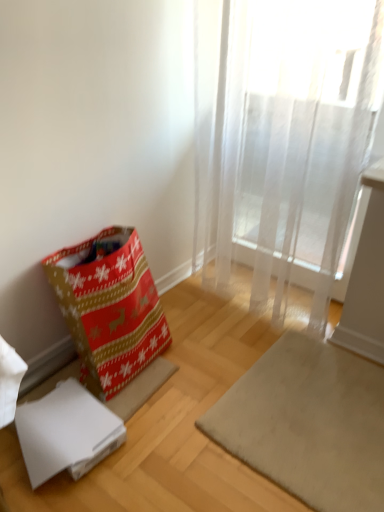
What do you see at coordinates (308, 423) in the screenshot? This screenshot has width=384, height=512. I see `beige carpet at lower center` at bounding box center [308, 423].

What do you see at coordinates (66, 432) in the screenshot? I see `white cardboard box at lower left` at bounding box center [66, 432].

What do you see at coordinates (290, 142) in the screenshot? I see `translucent white curtain at upper right` at bounding box center [290, 142].

Image resolution: width=384 pixels, height=512 pixels. What do you see at coordinates (109, 307) in the screenshot? I see `christmas-patterned fabric gift bag at lower left` at bounding box center [109, 307].

At what (x,y) coordinates should I click in order to perform the action: click on beige carpet at lower center. Please return your answer as a coordinate pair (x, y). Looking at the image, I should click on (308, 423).

From a real-world perspective, is translucent white curtain at upper right above or below christmas-patterned fabric gift bag at lower left?

In terms of real-world spatial position, translucent white curtain at upper right is above christmas-patterned fabric gift bag at lower left.

Is translucent white curtain at upper right further to the viewer compared to christmas-patterned fabric gift bag at lower left?

No, it is not.

Can you confirm if translucent white curtain at upper right is positioned to the right of christmas-patterned fabric gift bag at lower left?

Correct, you'll find translucent white curtain at upper right to the right of christmas-patterned fabric gift bag at lower left.

Could you tell me if translucent white curtain at upper right is facing christmas-patterned fabric gift bag at lower left?

Yes, translucent white curtain at upper right is oriented towards christmas-patterned fabric gift bag at lower left.

Is white cardboard box at lower left positioned with its back to beige carpet at lower center?

No, white cardboard box at lower left is not facing the opposite direction of beige carpet at lower center.

Looking at this image, would you say white cardboard box at lower left is inside or outside beige carpet at lower center?

white cardboard box at lower left is outside beige carpet at lower center.

Who is more distant, white cardboard box at lower left or beige carpet at lower center?

white cardboard box at lower left is more distant.

From a real-world perspective, between white cardboard box at lower left and beige carpet at lower center, who is vertically higher?

In real-world perspective, white cardboard box at lower left is above.

Which is more to the right, translucent white curtain at upper right or white cardboard box at lower left?

From the viewer's perspective, translucent white curtain at upper right appears more on the right side.

Considering the sizes of translucent white curtain at upper right and white cardboard box at lower left in the image, is translucent white curtain at upper right wider or thinner than white cardboard box at lower left?

In the image, translucent white curtain at upper right appears to be more narrow than white cardboard box at lower left.

From the image's perspective, which is above, translucent white curtain at upper right or white cardboard box at lower left?

translucent white curtain at upper right appears higher in the image.

Which object is closer to the camera taking this photo, translucent white curtain at upper right or white cardboard box at lower left?

translucent white curtain at upper right is in front.

Would you say white cardboard box at lower left contains christmas-patterned fabric gift bag at lower left?

No, christmas-patterned fabric gift bag at lower left is located outside of white cardboard box at lower left.

Is white cardboard box at lower left not near christmas-patterned fabric gift bag at lower left?

white cardboard box at lower left is near christmas-patterned fabric gift bag at lower left, not far away.

How different are the orientations of white cardboard box at lower left and christmas-patterned fabric gift bag at lower left in degrees?

The angular difference between white cardboard box at lower left and christmas-patterned fabric gift bag at lower left is 2.31 degrees.

Is white cardboard box at lower left taller than christmas-patterned fabric gift bag at lower left?

No, white cardboard box at lower left is not taller than christmas-patterned fabric gift bag at lower left.

Where is `mat in front of the translucent white curtain at upper right`? The width and height of the screenshot is (384, 512). mat in front of the translucent white curtain at upper right is located at coordinates (308, 423).

Is beige carpet at lower center in contact with translucent white curtain at upper right?

No, beige carpet at lower center is not touching translucent white curtain at upper right.

From the picture: Who is bigger, beige carpet at lower center or translucent white curtain at upper right?

translucent white curtain at upper right is bigger.

Is christmas-patterned fabric gift bag at lower left to the left or to the right of white cardboard box at lower left in the image?

Clearly, christmas-patterned fabric gift bag at lower left is on the right of white cardboard box at lower left in the image.

Is christmas-patterned fabric gift bag at lower left beside white cardboard box at lower left?

No, christmas-patterned fabric gift bag at lower left is not beside white cardboard box at lower left.

How different are the orientations of christmas-patterned fabric gift bag at lower left and white cardboard box at lower left in degrees?

2.31 degrees.

From the image's perspective, relative to white cardboard box at lower left, is christmas-patterned fabric gift bag at lower left above or below?

christmas-patterned fabric gift bag at lower left is situated higher than white cardboard box at lower left in the image.

From the image's perspective, is beige carpet at lower center below white cardboard box at lower left?

Actually, beige carpet at lower center appears above white cardboard box at lower left in the image.

Is beige carpet at lower center completely or partially outside of white cardboard box at lower left?

Yes, beige carpet at lower center is outside of white cardboard box at lower left.

Does point (256, 391) lie in front of point (112, 419)?

No, it is behind (112, 419).

Where is `gift bag on the left of translucent white curtain at upper right`? The image size is (384, 512). gift bag on the left of translucent white curtain at upper right is located at coordinates (109, 307).

You are a GUI agent. You are given a task and a screenshot of the screen. Output one action in this format:
    pyautogui.click(x=<x>, y=<y>)
    Task: Click on the cardboard box located behind the beige carpet at lower center
    
    Given the screenshot: What is the action you would take?
    pyautogui.click(x=66, y=432)

Considering their positions, is beige carpet at lower center positioned closer to white cardboard box at lower left than translucent white curtain at upper right?

The object closer to white cardboard box at lower left is beige carpet at lower center.

From the image, which object appears to be nearer to beige carpet at lower center, white cardboard box at lower left or translucent white curtain at upper right?

white cardboard box at lower left is closer to beige carpet at lower center.

From the image, which object appears to be nearer to beige carpet at lower center, white cardboard box at lower left or christmas-patterned fabric gift bag at lower left?

white cardboard box at lower left lies closer to beige carpet at lower center than the other object.

From the image, which object appears to be farther from beige carpet at lower center, christmas-patterned fabric gift bag at lower left or translucent white curtain at upper right?

The object further to beige carpet at lower center is translucent white curtain at upper right.

Consider the image. Considering their positions, is christmas-patterned fabric gift bag at lower left positioned further to beige carpet at lower center than white cardboard box at lower left?

christmas-patterned fabric gift bag at lower left.

Which object lies nearer to the anchor point translucent white curtain at upper right, christmas-patterned fabric gift bag at lower left or beige carpet at lower center?

Among the two, beige carpet at lower center is located nearer to translucent white curtain at upper right.

Estimate the real-world distances between objects in this image. Which object is closer to translucent white curtain at upper right, white cardboard box at lower left or beige carpet at lower center?

Based on the image, beige carpet at lower center appears to be nearer to translucent white curtain at upper right.

When comparing their distances from white cardboard box at lower left, does translucent white curtain at upper right or beige carpet at lower center seem further?

translucent white curtain at upper right is positioned further to the anchor white cardboard box at lower left.

What are the coordinates of `gift bag between translucent white curtain at upper right and white cardboard box at lower left in the up-down direction` in the screenshot? It's located at (109, 307).

Image resolution: width=384 pixels, height=512 pixels. What are the coordinates of `gift bag between translucent white curtain at upper right and beige carpet at lower center vertically` in the screenshot? It's located at (109, 307).

Locate an element on the screen. Image resolution: width=384 pixels, height=512 pixels. mat between translucent white curtain at upper right and white cardboard box at lower left vertically is located at coordinates (308, 423).

At what (x,y) coordinates should I click in order to perform the action: click on gift bag between white cardboard box at lower left and beige carpet at lower center from left to right. Please return your answer as a coordinate pair (x, y). The height and width of the screenshot is (512, 384). Looking at the image, I should click on (109, 307).